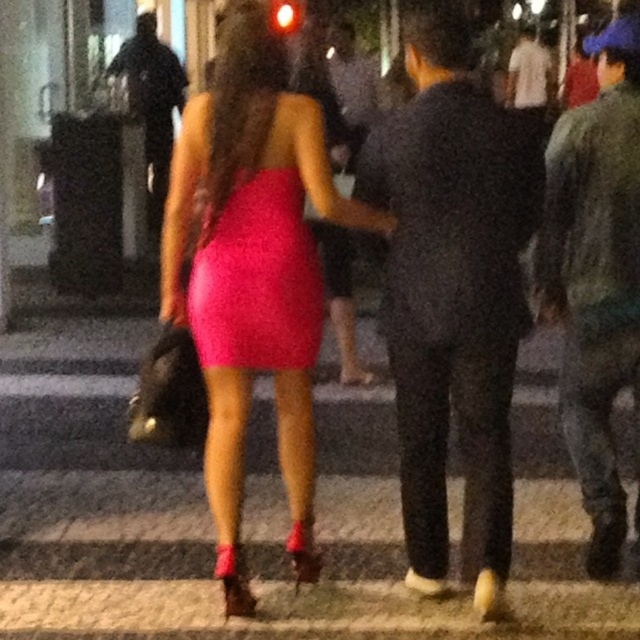
Question: Which point is closer to the camera?

Choices:
 (A) (154, 42)
 (B) (557, 634)
 (C) (508, 284)
 (D) (218, 364)

Answer: (C)

Question: Is matte pink dress at center to the right of shiny pink dress at center from the viewer's perspective?

Choices:
 (A) no
 (B) yes

Answer: (B)

Question: Can you confirm if matte pink dress at center is wider than shiny pink dress at center?

Choices:
 (A) no
 (B) yes

Answer: (B)

Question: Where is dark gray suit at center located in relation to black leather jacket at upper left in the image?

Choices:
 (A) below
 (B) above

Answer: (A)

Question: Which point is farther to the camera?

Choices:
 (A) (376, 444)
 (B) (200, 358)
 (C) (604, 444)
 (D) (144, 58)

Answer: (D)

Question: Which of the following is the closest to the observer?

Choices:
 (A) (156, 195)
 (B) (534, 77)
 (C) (260, 292)

Answer: (C)